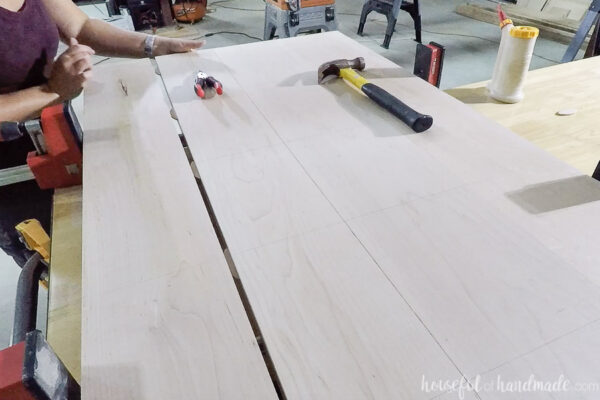
Identify the location of wooden boards. (155, 265), (297, 245), (468, 209).